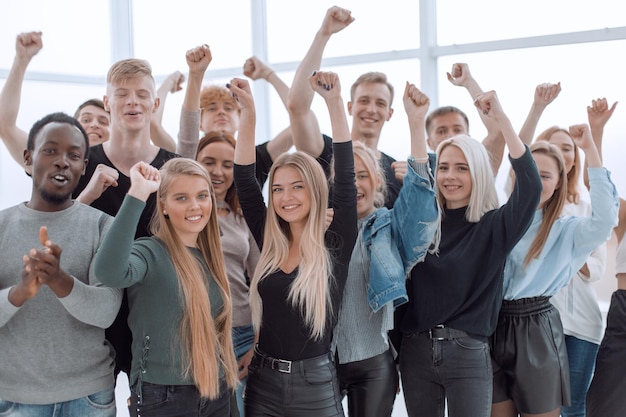
This screenshot has width=626, height=417. In order to click on window in this screenshot , I will do `click(58, 40)`, `click(61, 97)`, `click(185, 13)`, `click(364, 33)`, `click(172, 105)`, `click(401, 136)`, `click(491, 21)`, `click(501, 73)`.